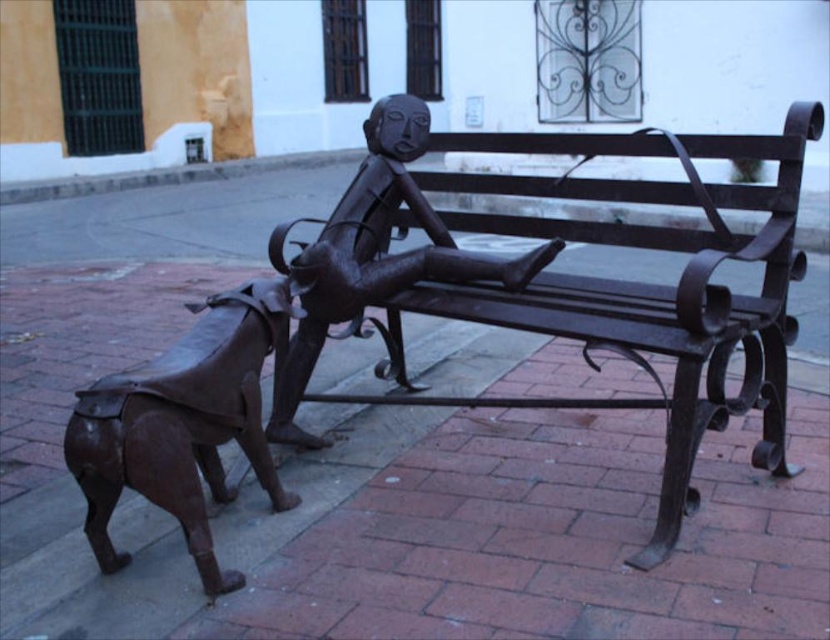
Which of these two, black wrought iron bench at center or brown polished metal dog at lower left, stands shorter?

brown polished metal dog at lower left

Measure the distance between point (792,156) and camera.

Point (792,156) is 2.15 meters from camera.

At what (x,y) coordinates should I click in order to perform the action: click on black wrought iron bench at center. Please return your answer as a coordinate pair (x, y). The image size is (830, 640). Looking at the image, I should click on (579, 280).

Is bronze dog at lower left behind brown polished metal dog at lower left?

Yes, it is.

From the picture: Is bronze dog at lower left positioned before brown polished metal dog at lower left?

No, bronze dog at lower left is further to the viewer.

What do you see at coordinates (259, 356) in the screenshot? I see `bronze dog at lower left` at bounding box center [259, 356].

You are a GUI agent. You are given a task and a screenshot of the screen. Output one action in this format:
    pyautogui.click(x=<x>, y=<y>)
    Task: Click on the bronze dog at lower left
    
    Given the screenshot: What is the action you would take?
    pyautogui.click(x=259, y=356)

Can you confirm if black wrought iron bench at center is positioned below bronze figure at center?

Actually, black wrought iron bench at center is above bronze figure at center.

Does black wrought iron bench at center have a smaller size compared to bronze figure at center?

No, black wrought iron bench at center is not smaller than bronze figure at center.

Between point (667, 467) and point (538, 253), which one is positioned behind?

Point (538, 253)

Image resolution: width=830 pixels, height=640 pixels. What are the coordinates of `black wrought iron bench at center` in the screenshot? It's located at (579, 280).